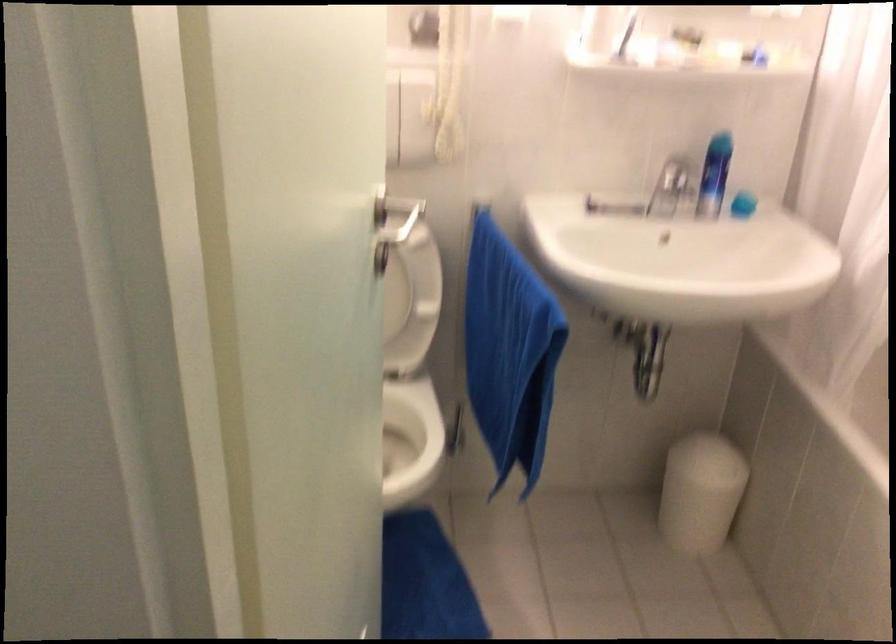
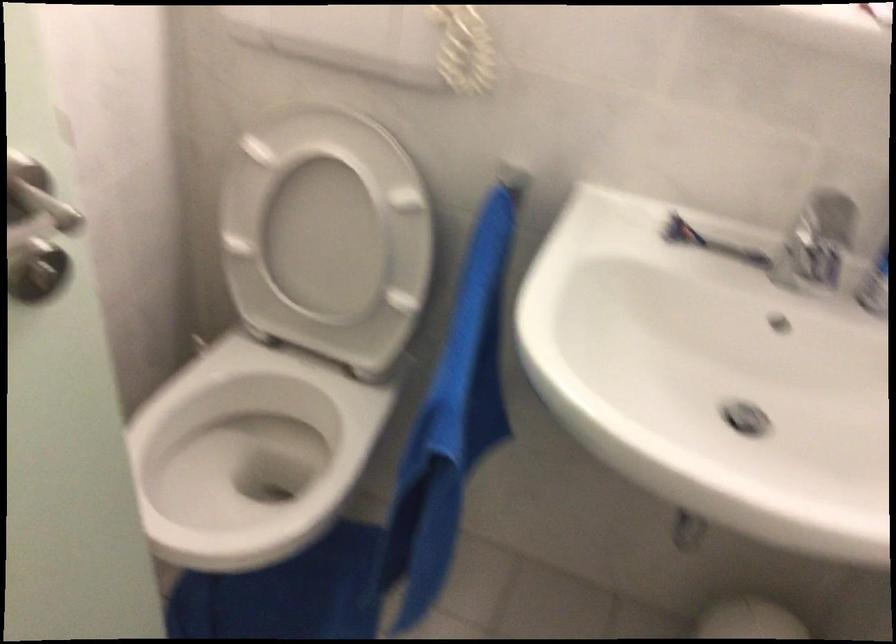
What movement of the cameraman would produce the second image?

The cameraman walked toward right, forward.